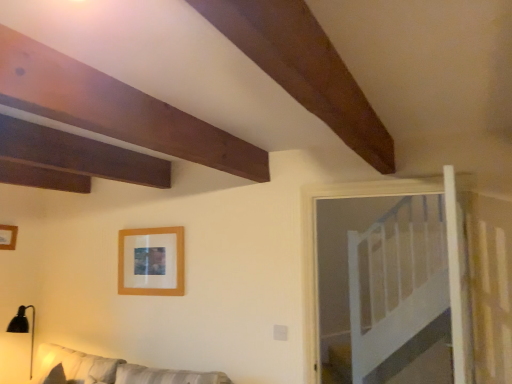
Question: Can you confirm if white fabric couch at lower left is taller than white wooden bed at upper right?

Choices:
 (A) no
 (B) yes

Answer: (A)

Question: Are white fabric couch at lower left and white wooden bed at upper right far apart?

Choices:
 (A) no
 (B) yes

Answer: (B)

Question: Does white fabric couch at lower left have a lesser width compared to white wooden bed at upper right?

Choices:
 (A) no
 (B) yes

Answer: (A)

Question: From a real-world perspective, is white fabric couch at lower left on top of white wooden bed at upper right?

Choices:
 (A) yes
 (B) no

Answer: (B)

Question: Is white fabric couch at lower left at the right side of white wooden bed at upper right?

Choices:
 (A) no
 (B) yes

Answer: (A)

Question: Is white wooden bed at upper right to the left or to the right of white fabric couch at lower left in the image?

Choices:
 (A) left
 (B) right

Answer: (B)

Question: From a real-world perspective, is white wooden bed at upper right positioned above or below white fabric couch at lower left?

Choices:
 (A) below
 (B) above

Answer: (B)

Question: From the image's perspective, is white wooden bed at upper right positioned above or below white fabric couch at lower left?

Choices:
 (A) above
 (B) below

Answer: (A)

Question: Based on their sizes in the image, would you say white wooden bed at upper right is bigger or smaller than white fabric couch at lower left?

Choices:
 (A) big
 (B) small

Answer: (B)

Question: In terms of width, does wooden frame at upper left, arranged as the first picture frame when viewed from the left, look wider or thinner when compared to white wooden bed at upper right?

Choices:
 (A) wide
 (B) thin

Answer: (B)

Question: Does point (7, 233) appear closer or farther from the camera than point (373, 345)?

Choices:
 (A) closer
 (B) farther

Answer: (A)

Question: Is wooden frame at upper left, arranged as the first picture frame when viewed from the left, inside the boundaries of white wooden bed at upper right, or outside?

Choices:
 (A) outside
 (B) inside

Answer: (A)

Question: From the image's perspective, relative to white wooden bed at upper right, is wooden frame at upper left, the second picture frame positioned from the right, above or below?

Choices:
 (A) above
 (B) below

Answer: (A)

Question: Is point click(421, 311) positioned closer to the camera than point click(145, 273)?

Choices:
 (A) closer
 (B) farther

Answer: (B)

Question: Relative to wooden frame at upper center, the 2th picture frame viewed from the left, is white wooden bed at upper right in front or behind?

Choices:
 (A) front
 (B) behind

Answer: (A)